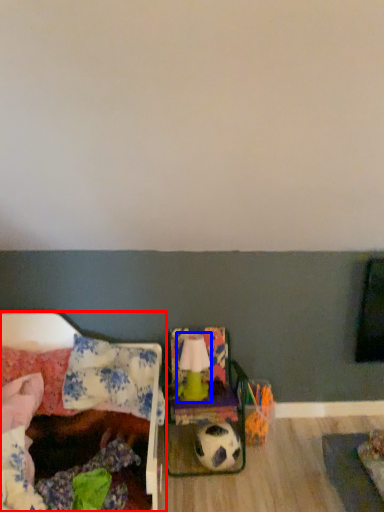
Question: Which object appears closest to the camera in this image, furniture (highlighted by a red box) or lamp (highlighted by a blue box)?

Choices:
 (A) furniture
 (B) lamp

Answer: (A)